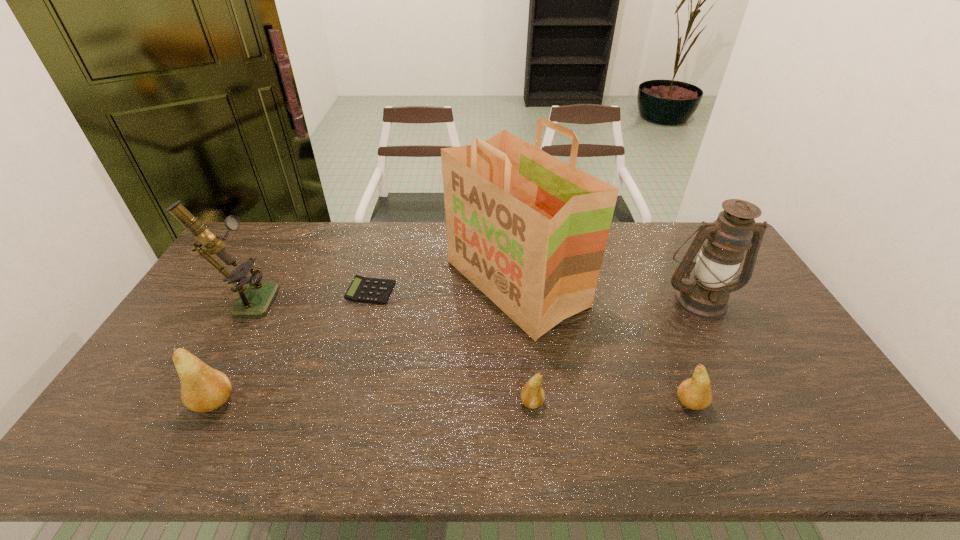
I want to click on free space between the tallest pear and the microscope, so click(x=230, y=350).

You are a GUI agent. You are given a task and a screenshot of the screen. Output one action in this format:
    pyautogui.click(x=<x>, y=<y>)
    Task: Click on the blank region between the tallest object and the sixth tallest object
    
    Given the screenshot: What is the action you would take?
    pyautogui.click(x=523, y=343)

Identify the location of empty space that is in between the rightmost pear and the fourth tallest object. (452, 402).

I want to click on the sixth closest object relative to the fourth tallest object, so click(705, 295).

This screenshot has height=540, width=960. In order to click on the fourth closest object to the shortest pear in this screenshot , I will do `click(362, 289)`.

Select which pear is the closest to the calculator. Please provide its 2D coordinates. Your answer should be formatted as a tuple, i.e. [(x, y)], where the tuple contains the x and y coordinates of a point satisfying the conditions above.

[(203, 389)]

At what (x,y) coordinates should I click in order to perform the action: click on pear object that ranks as the third closest to the fifth object from right to left. Please return your answer as a coordinate pair (x, y). Looking at the image, I should click on (695, 393).

Where is `vacant region that satisfies the following two spatial constraints: 1. on the front side of the tallest pear; 2. on the left side of the shortest pear`? The height and width of the screenshot is (540, 960). vacant region that satisfies the following two spatial constraints: 1. on the front side of the tallest pear; 2. on the left side of the shortest pear is located at coordinates (214, 402).

Locate an element on the screen. This screenshot has width=960, height=540. free spot that satisfies the following two spatial constraints: 1. on the front side of the second pear from left to right; 2. on the right side of the rightmost pear is located at coordinates (532, 403).

Identify the location of vacant region that satisfies the following two spatial constraints: 1. at the eyepiece of the rightmost pear; 2. on the right side of the microscope. This screenshot has height=540, width=960. (187, 403).